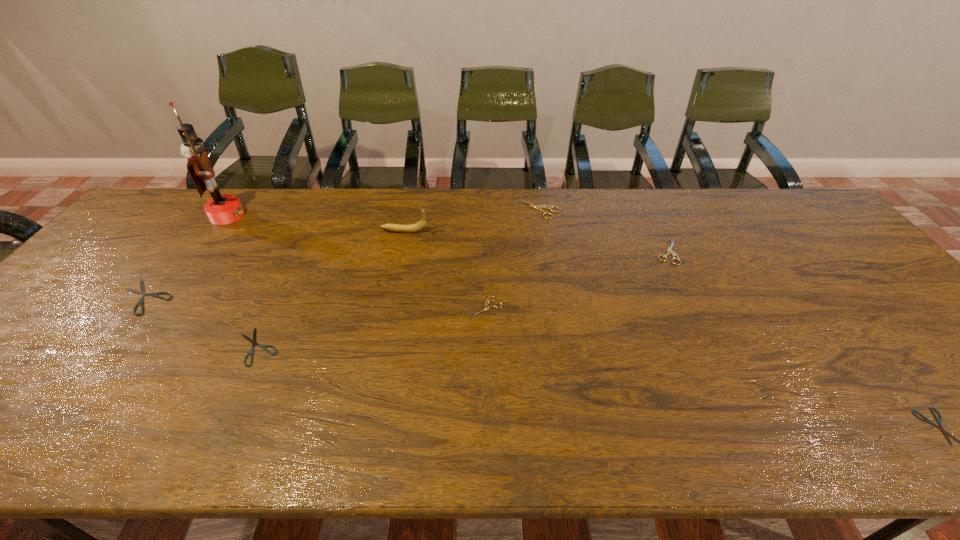
Locate an element on the screen. This screenshot has width=960, height=540. vacant area situated on the right of the second biggest black shears is located at coordinates (330, 347).

Where is `nutcracker located at the far edge`? nutcracker located at the far edge is located at coordinates (221, 209).

What are the coordinates of `banana that is positioned at the far edge` in the screenshot? It's located at (420, 225).

At what (x,y) coordinates should I click in order to perform the action: click on shears positioned at the far edge. Please return your answer as a coordinate pair (x, y). This screenshot has height=540, width=960. Looking at the image, I should click on (538, 207).

At what (x,y) coordinates should I click in order to perform the action: click on object that is at the left edge. Please return your answer as a coordinate pair (x, y). The image size is (960, 540). Looking at the image, I should click on (141, 292).

This screenshot has width=960, height=540. What are the coordinates of `vacant position at the far edge of the desktop` in the screenshot? It's located at (547, 223).

This screenshot has height=540, width=960. In the image, there is a desktop. In order to click on vacant space at the near edge in this screenshot , I will do `click(76, 441)`.

The height and width of the screenshot is (540, 960). I want to click on vacant area at the right edge of the desktop, so click(x=863, y=274).

At what (x,y) coordinates should I click in order to perform the action: click on vacant point at the far right corner. Please return your answer as a coordinate pair (x, y). Image resolution: width=960 pixels, height=540 pixels. Looking at the image, I should click on (782, 219).

Locate an element on the screen. unoccupied area between the nutcracker and the sixth object from right to left is located at coordinates (242, 281).